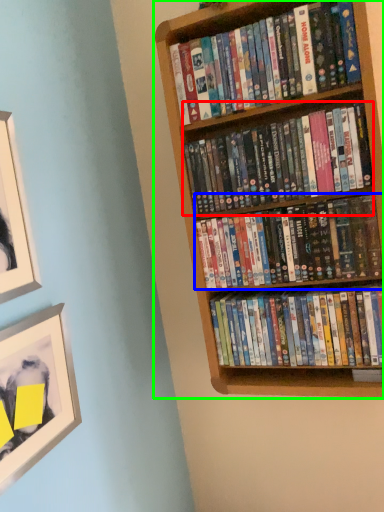
Question: Which object is positioned closest to book (highlighted by a red box)? Select from book (highlighted by a blue box) and bookcase (highlighted by a green box).

Choices:
 (A) book
 (B) bookcase

Answer: (A)